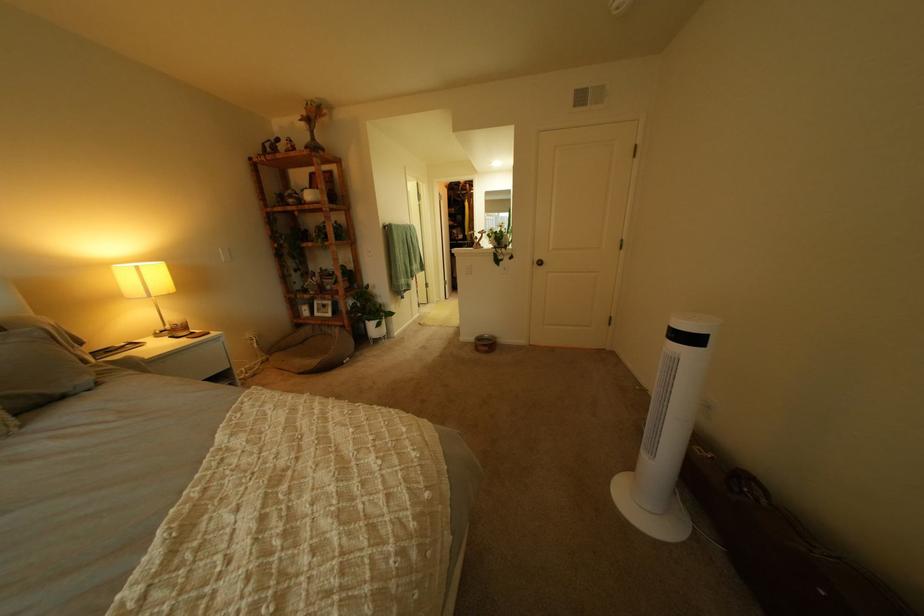
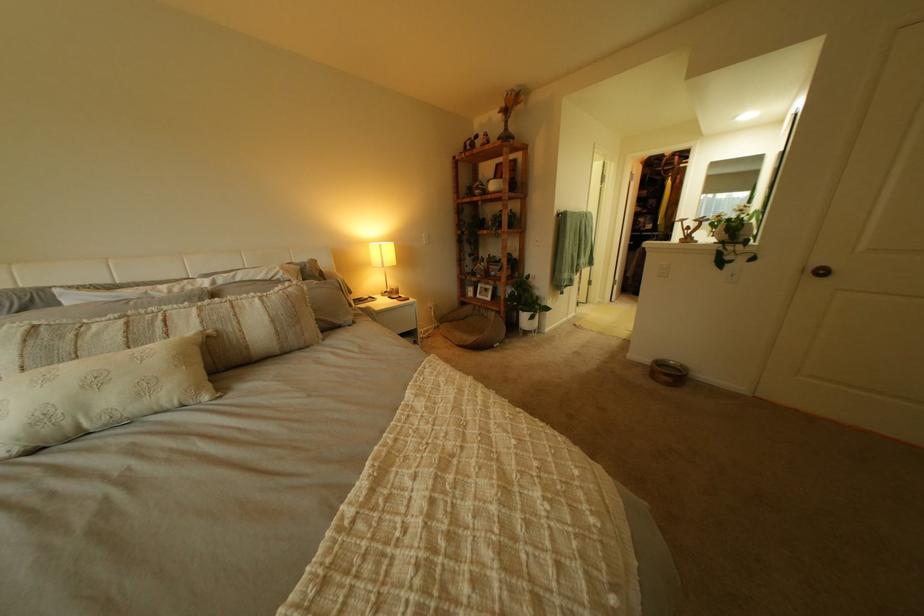
Question: The camera is either moving clockwise (left) or counter-clockwise (right) around the object. The first image is from the beginning of the video and the second image is from the end. Is the camera moving left or right when shooting the video?

Choices:
 (A) Left
 (B) Right

Answer: (B)